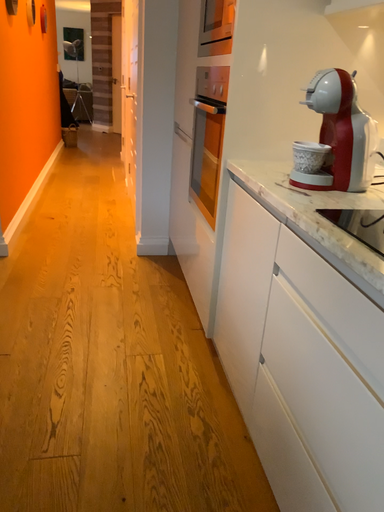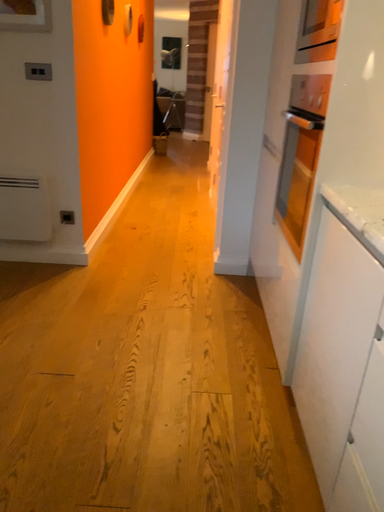
Question: How did the camera likely rotate when shooting the video?

Choices:
 (A) rotated right
 (B) rotated left

Answer: (B)